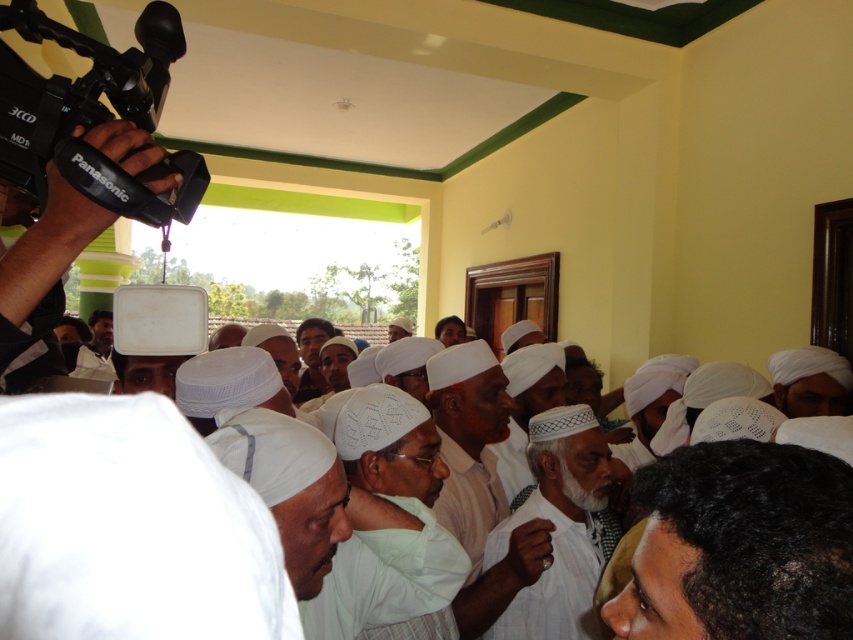
Who is more forward, (769, 369) or (463, 323)?

Point (769, 369) is more forward.

Can you confirm if white matte turban at center is taller than white cotton turban at center?

Yes, white matte turban at center is taller than white cotton turban at center.

Locate an element on the screen. white matte turban at center is located at coordinates (809, 380).

The image size is (853, 640). Identify the location of white matte turban at center. (x=809, y=380).

Is point (45, 148) positioned after point (573, 598)?

No, (45, 148) is in front of (573, 598).

At what (x,y) coordinates should I click in order to perform the action: click on black plastic video camera at upper left. Please return your answer as a coordinate pair (x, y). Looking at the image, I should click on (93, 113).

Does point (813, 522) lie behind point (10, 109)?

No.

You are a GUI agent. You are given a task and a screenshot of the screen. Output one action in this format:
    pyautogui.click(x=<x>, y=<y>)
    Task: Click on the black matte hair at lower right
    
    Given the screenshot: What is the action you would take?
    pyautogui.click(x=740, y=545)